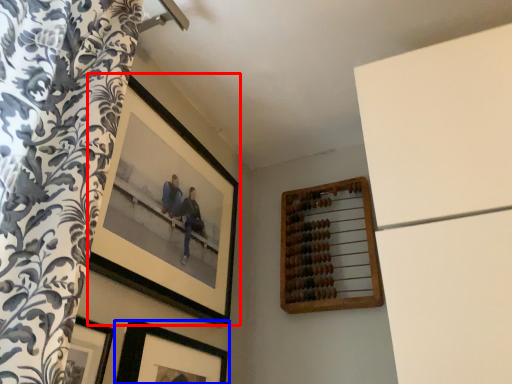
Question: Which object appears closest to the camera in this image, picture frame (highlighted by a red box) or picture frame (highlighted by a blue box)?

Choices:
 (A) picture frame
 (B) picture frame

Answer: (B)